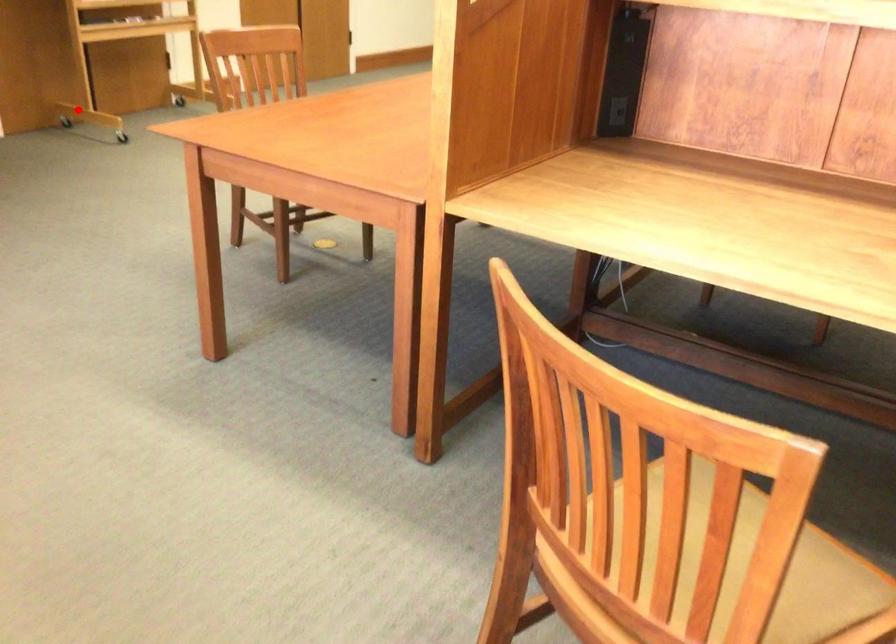
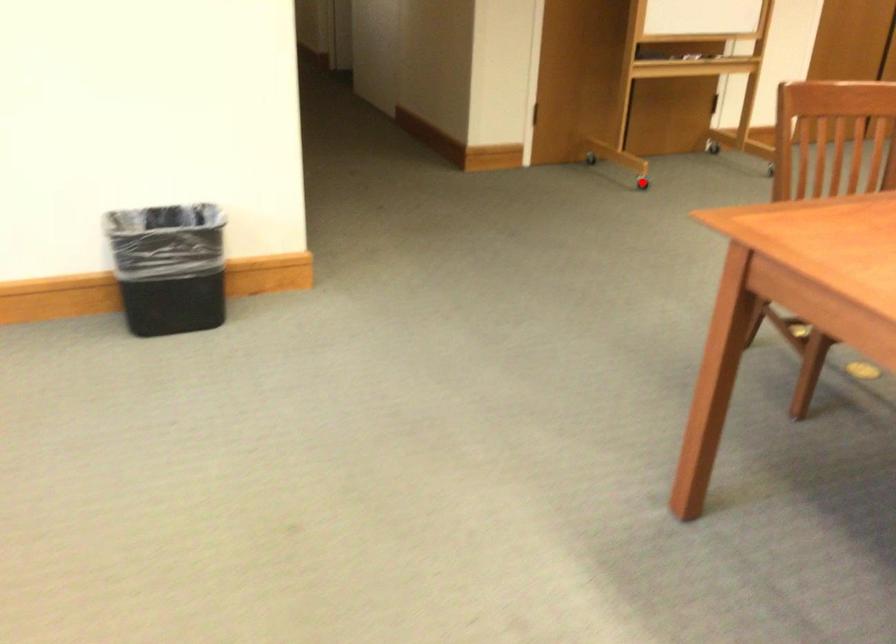
I am providing you with two images of the same scene from different viewpoints. A red point is marked on the first image and another point is marked on the second image. Is the marked point in image1 the same physical position as the marked point in image2?

No